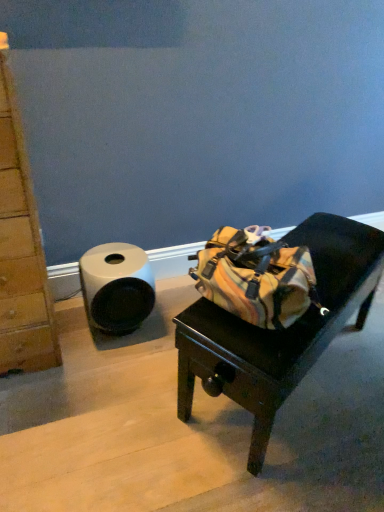
Question: Is white matte toilet paper at left beside multicolored fabric bag at center?

Choices:
 (A) no
 (B) yes

Answer: (A)

Question: From a real-world perspective, does white matte toilet paper at left sit lower than multicolored fabric bag at center?

Choices:
 (A) no
 (B) yes

Answer: (B)

Question: Is white matte toilet paper at left at the left side of multicolored fabric bag at center?

Choices:
 (A) yes
 (B) no

Answer: (A)

Question: From the image's perspective, is white matte toilet paper at left on multicolored fabric bag at center?

Choices:
 (A) yes
 (B) no

Answer: (A)

Question: Is the depth of white matte toilet paper at left greater than that of multicolored fabric bag at center?

Choices:
 (A) no
 (B) yes

Answer: (B)

Question: Does white matte toilet paper at left have a greater width compared to multicolored fabric bag at center?

Choices:
 (A) no
 (B) yes

Answer: (A)

Question: From a real-world perspective, is multicolored fabric bag at center over white matte toilet paper at left?

Choices:
 (A) no
 (B) yes

Answer: (B)

Question: Does multicolored fabric bag at center turn towards white matte toilet paper at left?

Choices:
 (A) yes
 (B) no

Answer: (B)

Question: Is multicolored fabric bag at center wider than white matte toilet paper at left?

Choices:
 (A) yes
 (B) no

Answer: (A)

Question: Considering the relative sizes of multicolored fabric bag at center and white matte toilet paper at left in the image provided, is multicolored fabric bag at center taller than white matte toilet paper at left?

Choices:
 (A) no
 (B) yes

Answer: (B)

Question: Is multicolored fabric bag at center further to camera compared to white matte toilet paper at left?

Choices:
 (A) yes
 (B) no

Answer: (B)

Question: Is multicolored fabric bag at center turned away from white matte toilet paper at left?

Choices:
 (A) yes
 (B) no

Answer: (A)

Question: Considering the positions of point (142, 300) and point (259, 394), is point (142, 300) closer or farther from the camera than point (259, 394)?

Choices:
 (A) farther
 (B) closer

Answer: (A)